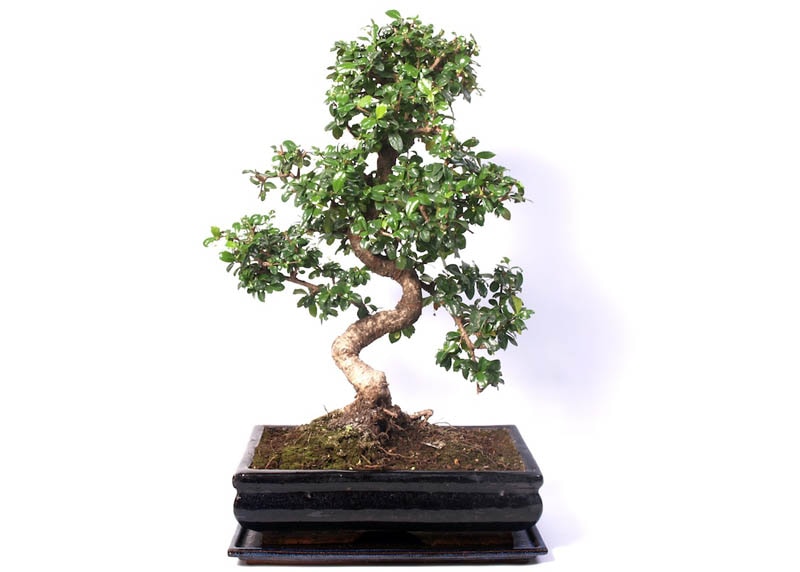
Locate an element on the screen. This screenshot has width=800, height=572. bonsai tree is located at coordinates (402, 23).